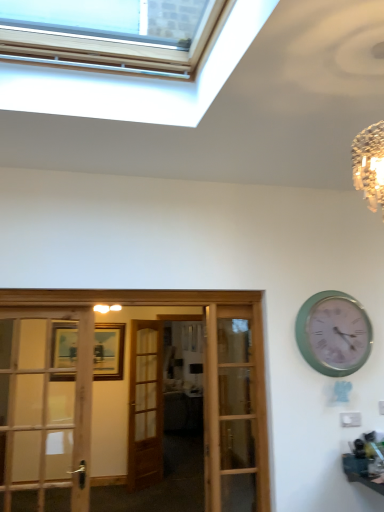
Locate an element on the screen. This screenshot has width=384, height=512. wooden french doors at center is located at coordinates (173, 305).

Describe the element at coordinates (173, 305) in the screenshot. I see `wooden french doors at center` at that location.

What do you see at coordinates (333, 333) in the screenshot?
I see `green metallic clock at upper right` at bounding box center [333, 333].

The height and width of the screenshot is (512, 384). In order to click on wooden french doors at center in this screenshot , I will do `click(173, 305)`.

Is wooden french doors at center taller than velvet brown couch at center?

Correct, wooden french doors at center is much taller as velvet brown couch at center.

From the image's perspective, between wooden french doors at center and velvet brown couch at center, who is located below?

velvet brown couch at center.

Is wooden french doors at center not close to velvet brown couch at center?

Yes, wooden french doors at center and velvet brown couch at center are quite far apart.

From a real-world perspective, is wooden french doors at center located beneath velvet brown couch at center?

No, from a real-world perspective, wooden french doors at center is not beneath velvet brown couch at center.

From a real-world perspective, is wooden french doors at center below green metallic clock at upper right?

Yes, from a real-world perspective, wooden french doors at center is under green metallic clock at upper right.

Can green metallic clock at upper right be found inside wooden french doors at center?

No, green metallic clock at upper right is located outside of wooden french doors at center.

Could you tell me if wooden french doors at center is facing green metallic clock at upper right?

No, wooden french doors at center is not oriented towards green metallic clock at upper right.

Is wooden french doors at center positioned behind green metallic clock at upper right?

No, the depth of wooden french doors at center is less than that of green metallic clock at upper right.

Considering the points (201, 392) and (209, 444), which point is in front, point (201, 392) or point (209, 444)?

The point (209, 444) is closer to the camera.

Which of these two, velvet brown couch at center or wooden french doors at center, is bigger?

With larger size is velvet brown couch at center.

Based on the photo, is velvet brown couch at center thinner than wooden french doors at center?

No, velvet brown couch at center is not thinner than wooden french doors at center.

Consider the image. Would you say velvet brown couch at center is to the left or to the right of green metallic clock at upper right in the picture?

Based on their positions, velvet brown couch at center is located to the left of green metallic clock at upper right.

Which is correct: velvet brown couch at center is inside green metallic clock at upper right, or outside of it?

velvet brown couch at center is not enclosed by green metallic clock at upper right.

Is the depth of velvet brown couch at center greater than that of green metallic clock at upper right?

That is True.

Is velvet brown couch at center taller or shorter than green metallic clock at upper right?

In the image, velvet brown couch at center appears to be taller than green metallic clock at upper right.

Would you say wooden door at center is to the left or to the right of wooden french doors at center in the picture?

In the image, wooden door at center appears on the left side of wooden french doors at center.

Is wooden door at center aimed at wooden french doors at center?

No, wooden door at center is not oriented towards wooden french doors at center.

From the image's perspective, which is above, wooden door at center or wooden french doors at center?

From the image's view, wooden french doors at center is above.

Is point (160, 341) closer to viewer compared to point (140, 305)?

That is False.

What's the angular difference between wooden door at center and green metallic clock at upper right's facing directions?

The angular difference between wooden door at center and green metallic clock at upper right is 35.2 degrees.

Considering the relative sizes of wooden door at center and green metallic clock at upper right in the image provided, is wooden door at center wider than green metallic clock at upper right?

Incorrect, the width of wooden door at center does not surpass that of green metallic clock at upper right.

I want to click on door that is on the left side of green metallic clock at upper right, so click(145, 405).

Is wooden door at center inside or outside of green metallic clock at upper right?

wooden door at center is outside green metallic clock at upper right.

Between point (173, 425) and point (161, 428), which one is positioned behind?

Positioned behind is point (173, 425).

From the image's perspective, is velvet brown couch at center below wooden door at center?

Yes.

Is velvet brown couch at center beside wooden door at center?

No, velvet brown couch at center is not making contact with wooden door at center.

Where is `hotel lobby on the left side of velvet brown couch at center`? hotel lobby on the left side of velvet brown couch at center is located at coordinates (173, 305).

Image resolution: width=384 pixels, height=512 pixels. What are the coordinates of `hotel lobby below the green metallic clock at upper right (from the image's perspective)` in the screenshot? It's located at (173, 305).

Looking at this image, based on their spatial positions, is wooden french doors at center or velvet brown couch at center further from green metallic clock at upper right?

velvet brown couch at center is further to green metallic clock at upper right.

Based on the photo, which object lies further to the anchor point green metallic clock at upper right, wooden door at center or wooden french doors at center?

The object further to green metallic clock at upper right is wooden door at center.

Based on their spatial positions, is velvet brown couch at center or green metallic clock at upper right closer to wooden french doors at center?

Among the two, green metallic clock at upper right is located nearer to wooden french doors at center.

Which object lies further to the anchor point green metallic clock at upper right, velvet brown couch at center or wooden door at center?

The object further to green metallic clock at upper right is velvet brown couch at center.

Based on their spatial positions, is wooden french doors at center or wooden door at center closer to velvet brown couch at center?

Among the two, wooden door at center is located nearer to velvet brown couch at center.

Which object lies further to the anchor point wooden french doors at center, green metallic clock at upper right or velvet brown couch at center?

velvet brown couch at center is further to wooden french doors at center.

Looking at this image, which object lies nearer to the anchor point wooden door at center, wooden french doors at center or green metallic clock at upper right?

Among the two, wooden french doors at center is located nearer to wooden door at center.

Based on their spatial positions, is velvet brown couch at center or wooden french doors at center closer to green metallic clock at upper right?

wooden french doors at center.

Find the location of a particular element. Image resolution: width=384 pixels, height=512 pixels. door positioned between green metallic clock at upper right and velvet brown couch at center from near to far is located at coordinates (145, 405).

Identify the location of clock located between wooden french doors at center and wooden door at center in the depth direction. This screenshot has height=512, width=384. tap(333, 333).

This screenshot has width=384, height=512. Identify the location of door positioned between wooden french doors at center and velvet brown couch at center from near to far. (145, 405).

Locate an element on the screen. The height and width of the screenshot is (512, 384). clock between wooden french doors at center and velvet brown couch at center along the z-axis is located at coordinates (333, 333).